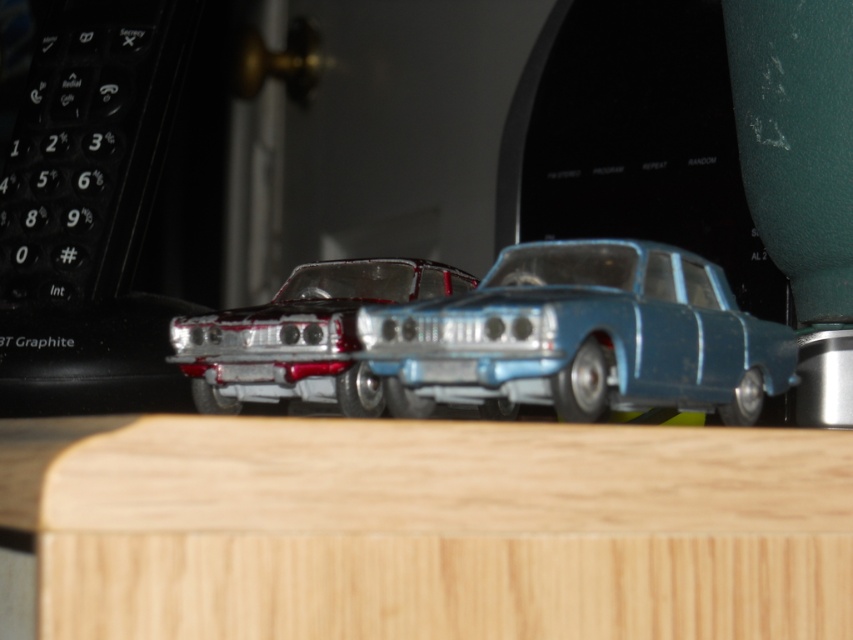
You are positioning a sticker on a wooden desk. The sticker must be placed exactly where the blue metallic car at center is located. What are the coordinates where you should place the sticker?

The coordinates for the blue metallic car at center are at point (583, 337).

You are a small toy car that wants to drive from the shiny metallic car at center to the light wood table at center. Can you drive directly to it without any obstacles?

The light wood table at center is below the shiny metallic car at center, so the car cannot drive directly to it since the table is underneath the car.